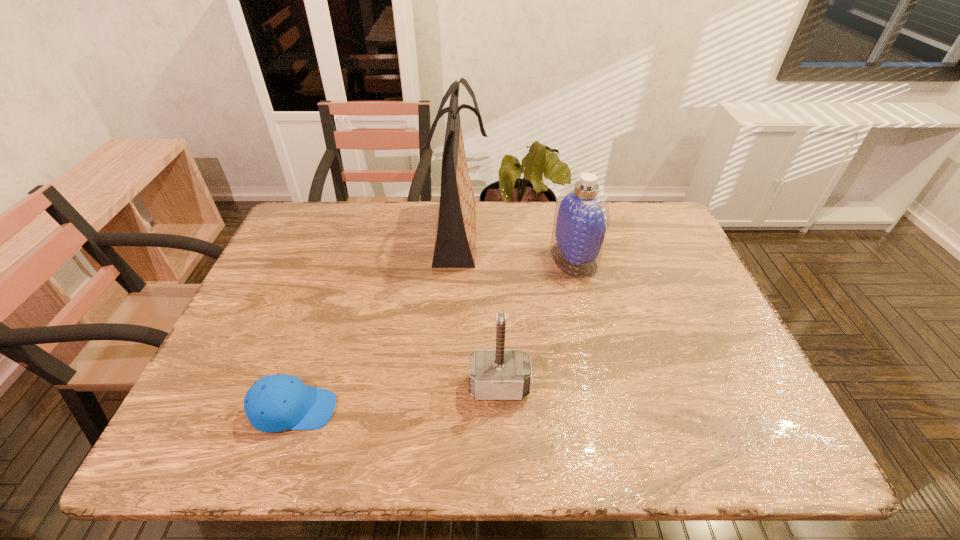
Where is `vacant space that satisfies the following two spatial constraints: 1. on the front-facing side of the cleansing agent; 2. on the right side of the tallest object`? The width and height of the screenshot is (960, 540). vacant space that satisfies the following two spatial constraints: 1. on the front-facing side of the cleansing agent; 2. on the right side of the tallest object is located at coordinates (457, 259).

Locate an element on the screen. Image resolution: width=960 pixels, height=540 pixels. vacant space that satisfies the following two spatial constraints: 1. for striking with the head of the third tallest object; 2. on the front-facing side of the leftmost object is located at coordinates (500, 409).

This screenshot has height=540, width=960. In order to click on free location that satisfies the following two spatial constraints: 1. on the front-facing side of the shopping bag; 2. on the right side of the rightmost object in this screenshot , I will do `click(457, 259)`.

At what (x,y) coordinates should I click in order to perform the action: click on free spot that satisfies the following two spatial constraints: 1. for striking with the head of the hammer; 2. on the front-facing side of the leftmost object. Please return your answer as a coordinate pair (x, y). The width and height of the screenshot is (960, 540). Looking at the image, I should click on (500, 409).

Where is `vacant region that satisfies the following two spatial constraints: 1. on the front-facing side of the rightmost object; 2. on the left side of the shopping bag`? The height and width of the screenshot is (540, 960). vacant region that satisfies the following two spatial constraints: 1. on the front-facing side of the rightmost object; 2. on the left side of the shopping bag is located at coordinates (457, 259).